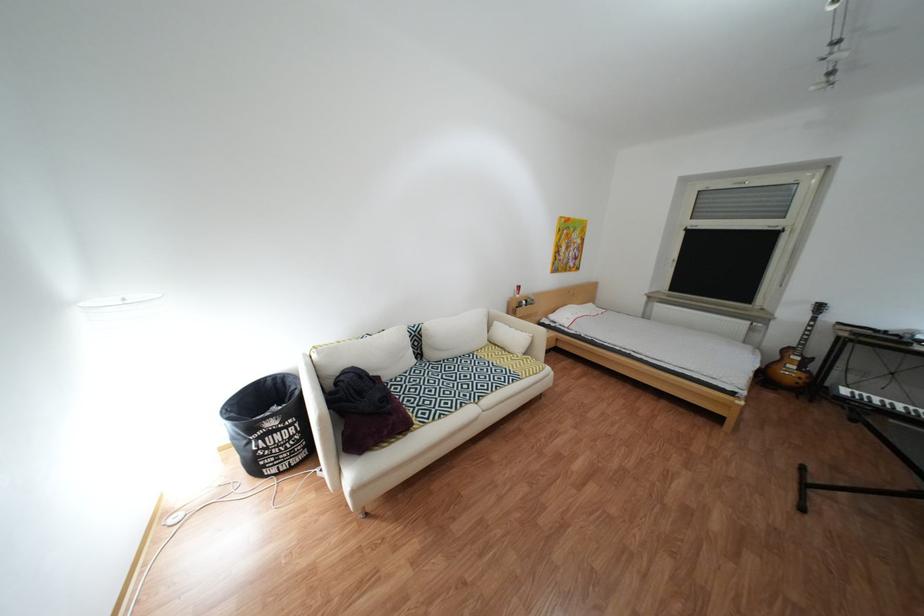
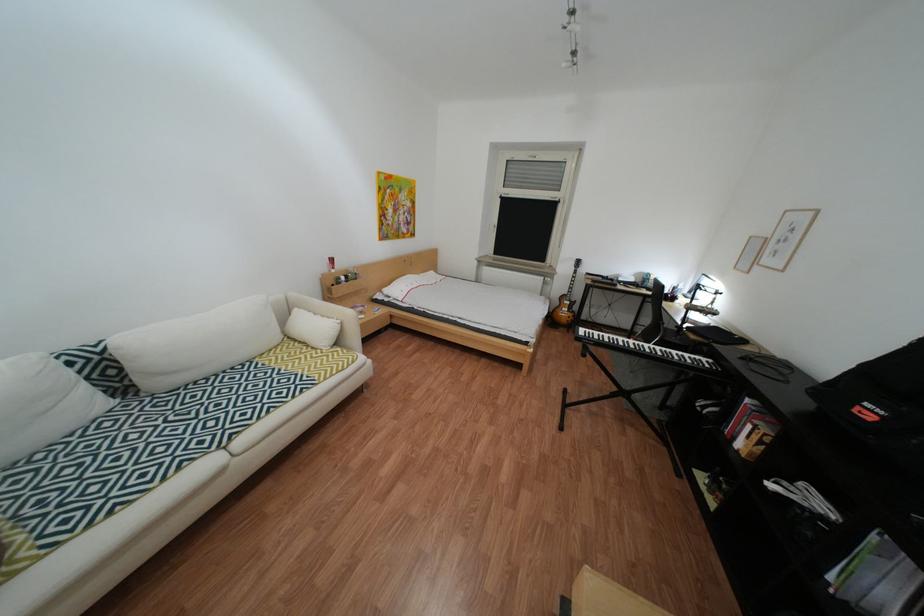
Find the pixel in the second image that matches the point at 512,346 in the first image.

(311, 342)